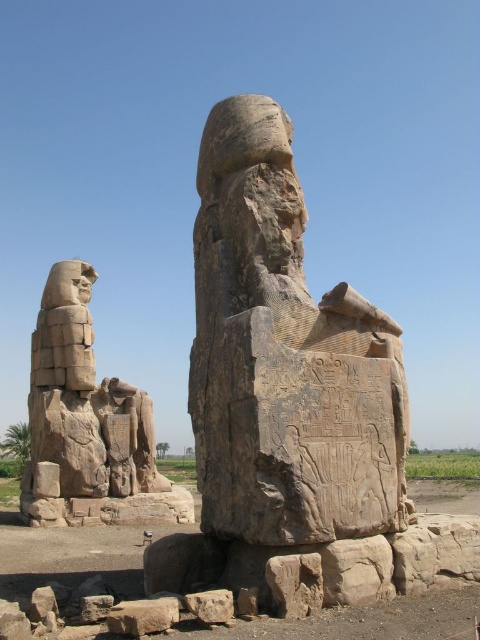
Question: Does granite statue at center have a greater width compared to brown rough stone at lower center?

Choices:
 (A) yes
 (B) no

Answer: (A)

Question: Which of the following is the farthest from the observer?

Choices:
 (A) (370, 534)
 (B) (276, 588)
 (C) (139, 611)
 (D) (210, 605)

Answer: (A)

Question: Among these points, which one is farthest from the camera?

Choices:
 (A) tap(228, 605)
 (B) tap(83, 611)
 (C) tap(276, 568)
 (D) tap(149, 608)

Answer: (B)

Question: Is granite statue at center thinner than gray stone at lower center?

Choices:
 (A) yes
 (B) no

Answer: (B)

Question: Estimate the real-world distances between objects in this image. Which object is closer to the brown rough stone at lower center?

Choices:
 (A) granite statue at center
 (B) gray stone at lower center
 (C) brown rough stone at center
 (D) rusty stone block at lower left

Answer: (C)

Question: Does granite statue at center have a lesser width compared to brown rough stone at lower center?

Choices:
 (A) yes
 (B) no

Answer: (B)